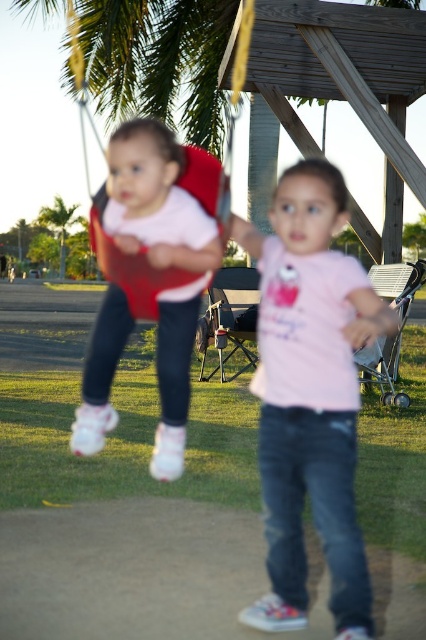
Question: Is pink matte shirt at center thinner than red fabric swing at left?

Choices:
 (A) yes
 (B) no

Answer: (A)

Question: From the image, what is the correct spatial relationship of red fabric swing at left in relation to green leafy palm tree at upper left?

Choices:
 (A) left
 (B) right

Answer: (B)

Question: Which object is the closest to the pink matte shirt at center?

Choices:
 (A) red fabric swing at left
 (B) matte pink shirt at left
 (C) green leafy palm tree at upper left

Answer: (B)

Question: Which object appears farthest from the camera in this image?

Choices:
 (A) green leafy palm tree at upper left
 (B) pink matte shirt at center

Answer: (A)

Question: Which object appears closest to the camera in this image?

Choices:
 (A) pink matte shirt at center
 (B) green leafy palm tree at upper left
 (C) red fabric swing at left
 (D) matte pink shirt at left

Answer: (A)

Question: Does pink matte shirt at center have a greater width compared to red fabric swing at left?

Choices:
 (A) yes
 (B) no

Answer: (B)